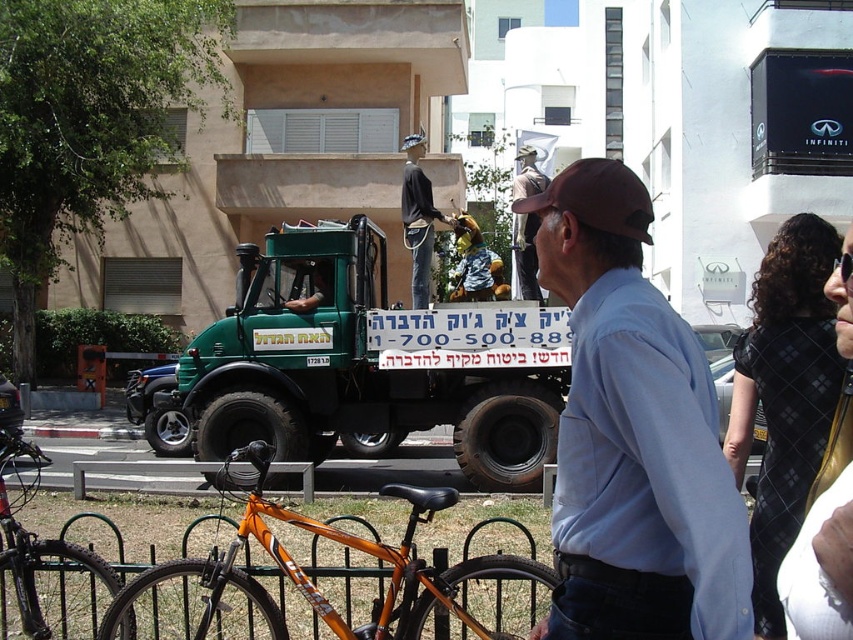
You are a delivery person who needs to park your delivery van in this area. The van requires a parking spot that is at least 5 meters long. The orange matte bicycle at lower center is currently occupying part of the potential parking area. Can you estimate if there is enough space left for your van?

The orange matte bicycle at lower center is located at point (312, 577). However, without knowing the dimensions of the parking area or the distance from the bicycle to the nearest obstacles, it is impossible to determine if there is enough space for the van.

You are a delivery person who needs to park your vehicle in this area. You have a large van that requires a space wider than the distance between the green matte truck at center and the orange matte bicycle at lower left. Is there enough space for your van to park between them?

The green matte truck at center is positioned on the right side of orange matte bicycle at lower left, so the space between them may not be sufficient for a large van that requires more width. Check the exact measurements before deciding to park there.

You are a pedestrian standing on the sidewalk looking at the orange matte bicycle at lower left and the brown fabric baseball cap at upper center. Which object is positioned more to the left?

The orange matte bicycle at lower left is positioned to the left of the brown fabric baseball cap at upper center, so the orange matte bicycle at lower left is more to the left.